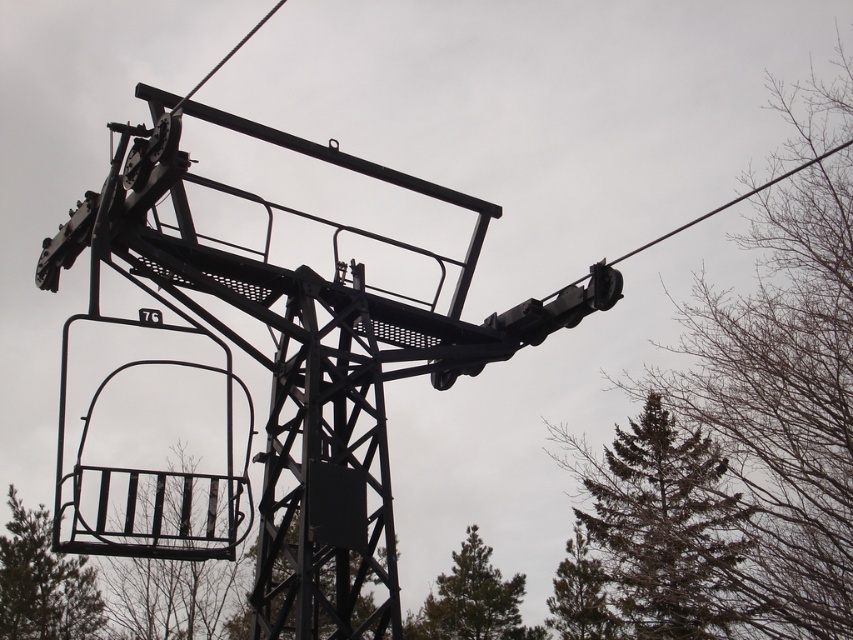
Between green textured pine tree at upper right and green textured pine tree at lower right, which one has less height?

Standing shorter between the two is green textured pine tree at lower right.

Does green textured pine tree at upper right have a lesser width compared to green textured pine tree at lower right?

No.

This screenshot has height=640, width=853. What do you see at coordinates (740, 433) in the screenshot? I see `green textured pine tree at upper right` at bounding box center [740, 433].

The width and height of the screenshot is (853, 640). Find the location of `green textured pine tree at upper right`. green textured pine tree at upper right is located at coordinates (740, 433).

The width and height of the screenshot is (853, 640). I want to click on metallic wire basket at lower left, so click(x=178, y=596).

Does metallic wire basket at lower left appear on the right side of green textured pine tree at lower right?

In fact, metallic wire basket at lower left is to the left of green textured pine tree at lower right.

What do you see at coordinates (178, 596) in the screenshot? Image resolution: width=853 pixels, height=640 pixels. I see `metallic wire basket at lower left` at bounding box center [178, 596].

I want to click on metallic wire basket at lower left, so click(x=178, y=596).

Is point (636, 422) more distant than point (576, 596)?

Yes, point (636, 422) is farther from viewer.

Between green matte tree at lower right and green textured pine tree at lower right, which one is positioned higher?

green matte tree at lower right is above.

Is point (598, 609) positioned behind point (563, 589)?

That is False.

In order to click on green matte tree at lower right in this screenshot , I will do `click(651, 538)`.